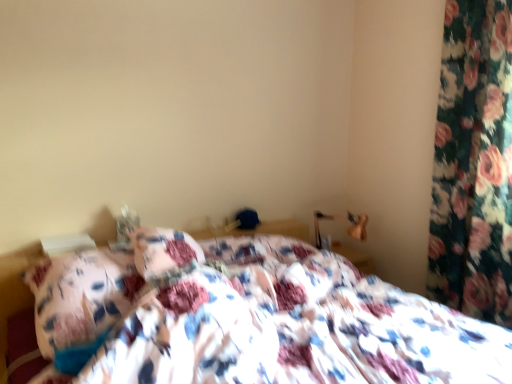
Identify the location of floral fabric curtain at right. Image resolution: width=512 pixels, height=384 pixels. (473, 164).

Measure the distance between floral fabric curtain at right and camera.

6.00 feet.

What do you see at coordinates (473, 164) in the screenshot?
I see `floral fabric curtain at right` at bounding box center [473, 164].

The image size is (512, 384). What do you see at coordinates (247, 318) in the screenshot? I see `floral fabric bed at center` at bounding box center [247, 318].

Locate an element on the screen. The image size is (512, 384). floral fabric bed at center is located at coordinates [x=247, y=318].

This screenshot has width=512, height=384. I want to click on floral fabric curtain at right, so click(x=473, y=164).

Considering the relative positions of floral fabric bed at center and floral fabric curtain at right in the image provided, is floral fabric bed at center to the left or to the right of floral fabric curtain at right?

Based on their positions, floral fabric bed at center is located to the left of floral fabric curtain at right.

Relative to floral fabric curtain at right, is floral fabric bed at center in front or behind?

Visually, floral fabric bed at center is located in front of floral fabric curtain at right.

Which is farther from the camera, (345, 310) or (487, 107)?

The point (487, 107) is more distant.

From the image's perspective, which is below, floral fabric bed at center or floral fabric curtain at right?

From the image's view, floral fabric bed at center is below.

From a real-world perspective, is floral fabric bed at center above or below floral fabric curtain at right?

floral fabric bed at center is situated lower than floral fabric curtain at right in the real world.

Does floral fabric bed at center have a greater width compared to floral fabric curtain at right?

Yes, floral fabric bed at center is wider than floral fabric curtain at right.

Is floral fabric bed at center taller than floral fabric curtain at right?

No, floral fabric bed at center is not taller than floral fabric curtain at right.

Considering the sizes of objects floral fabric bed at center and floral fabric curtain at right in the image provided, who is smaller, floral fabric bed at center or floral fabric curtain at right?

floral fabric curtain at right.

Would you say floral fabric bed at center is outside floral fabric curtain at right?

Yes.

Is floral fabric bed at center far away from floral fabric curtain at right?

Yes.

Consider the image. Is floral fabric bed at center oriented away from floral fabric curtain at right?

floral fabric bed at center does not have its back to floral fabric curtain at right.

In order to click on bed directly beneath the floral fabric curtain at right (from a real-world perspective) in this screenshot , I will do (247, 318).

Which is more to the right, floral fabric curtain at right or floral fabric bed at center?

floral fabric curtain at right.

Considering their positions, is floral fabric curtain at right located in front of or behind floral fabric bed at center?

floral fabric curtain at right is positioned farther from the viewer than floral fabric bed at center.

Is point (449, 231) closer to viewer compared to point (204, 358)?

No, (449, 231) is further to viewer.

From the image's perspective, is floral fabric curtain at right located above or below floral fabric bed at center?

floral fabric curtain at right is situated higher than floral fabric bed at center in the image.

From a real-world perspective, who is located lower, floral fabric curtain at right or floral fabric bed at center?

In real-world perspective, floral fabric bed at center is lower.

Is floral fabric curtain at right wider than floral fabric bed at center?

No.

Is floral fabric curtain at right taller than floral fabric bed at center?

Indeed, floral fabric curtain at right has a greater height compared to floral fabric bed at center.

Based on their sizes in the image, would you say floral fabric curtain at right is bigger or smaller than floral fabric bed at center?

floral fabric curtain at right is smaller than floral fabric bed at center.

Based on the photo, is floral fabric curtain at right outside of floral fabric bed at center?

floral fabric curtain at right is positioned outside floral fabric bed at center.

Is floral fabric curtain at right next to floral fabric bed at center and touching it?

No, floral fabric curtain at right is not touching floral fabric bed at center.

Is floral fabric curtain at right looking in the opposite direction of floral fabric bed at center?

floral fabric curtain at right is not turned away from floral fabric bed at center.

How different are the orientations of floral fabric curtain at right and floral fabric bed at center in degrees?

The angular difference between floral fabric curtain at right and floral fabric bed at center is 89.5 degrees.

Measure the distance between floral fabric curtain at right and floral fabric bed at center.

floral fabric curtain at right and floral fabric bed at center are 3.38 feet apart from each other.

The width and height of the screenshot is (512, 384). What are the coordinates of `bed that is under the floral fabric curtain at right (from a real-world perspective)` in the screenshot? It's located at (247, 318).

Locate an element on the screen. Image resolution: width=512 pixels, height=384 pixels. bed on the left of floral fabric curtain at right is located at coordinates (247, 318).

Find the location of a particular element. This screenshot has width=512, height=384. curtain behind the floral fabric bed at center is located at coordinates pyautogui.click(x=473, y=164).